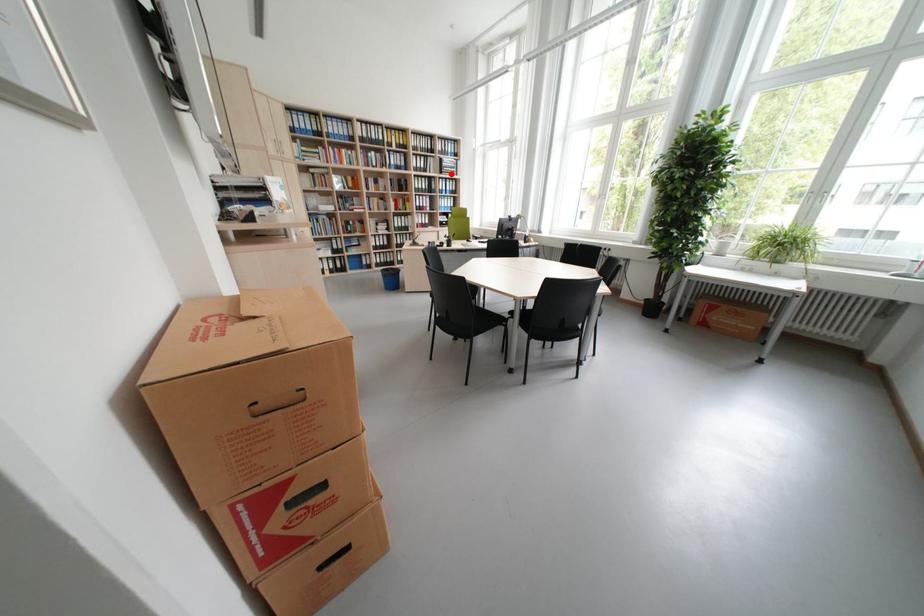
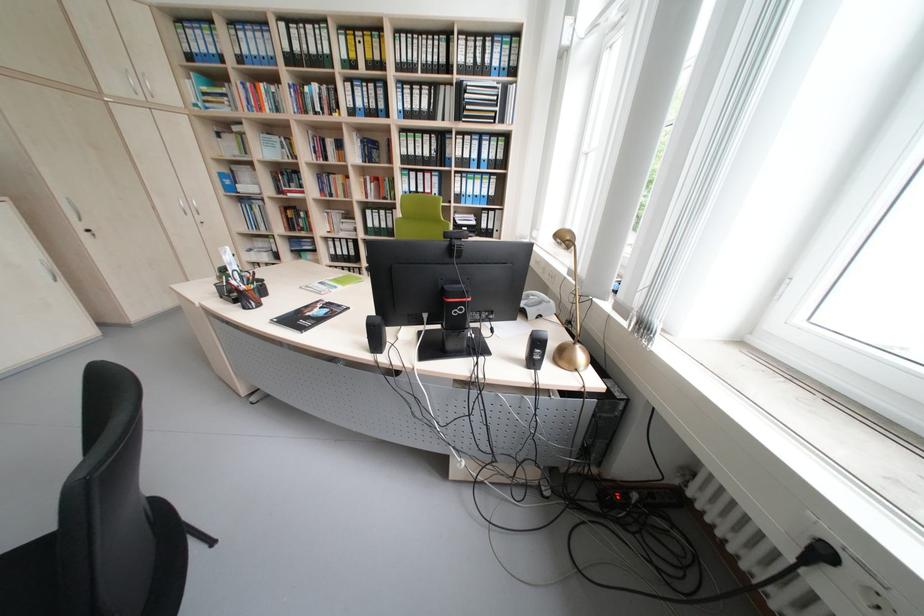
Question: A red point is marked in image1. In image2, is the corresponding 3D point closer to the camera or farther? Reply with the corresponding letter.

Choices:
 (A) The corresponding 3D point is closer.
 (B) The corresponding 3D point is farther.

Answer: (B)